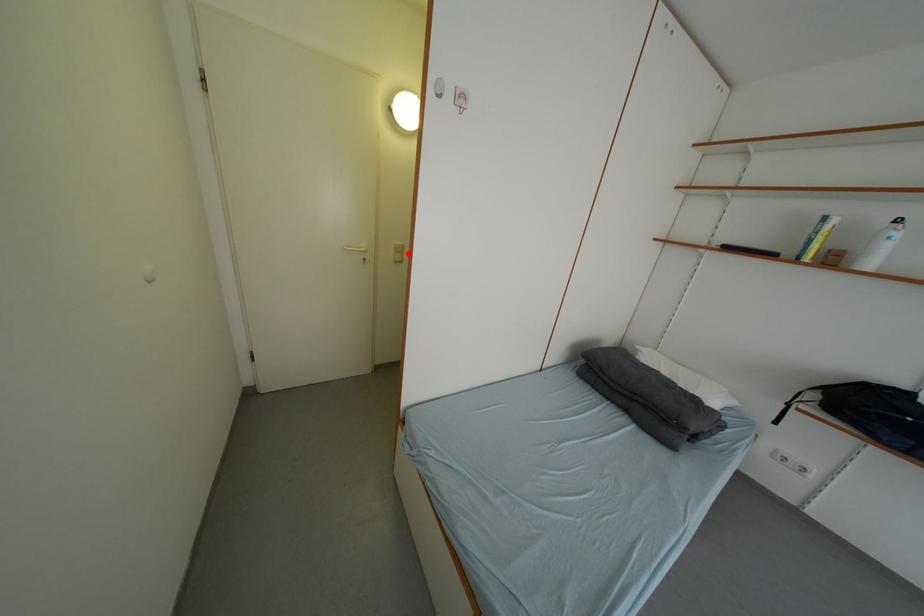
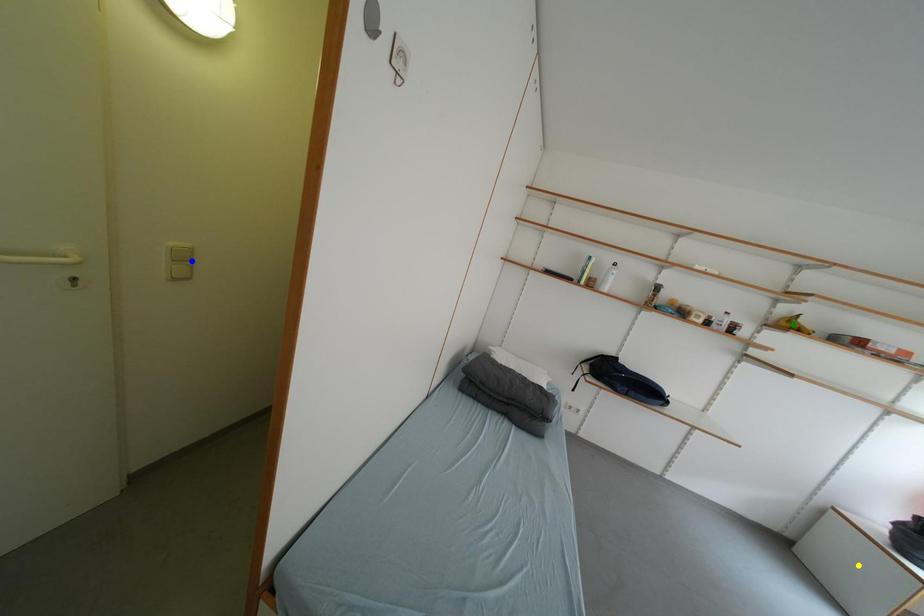
Question: I am providing you with two images of the same scene from different viewpoints. A red point is marked on the first image. You are given multiple points on the second image. Which point in image 2 represents the same 3d spot as the red point in image 1?

Choices:
 (A) green point
 (B) blue point
 (C) yellow point

Answer: (B)